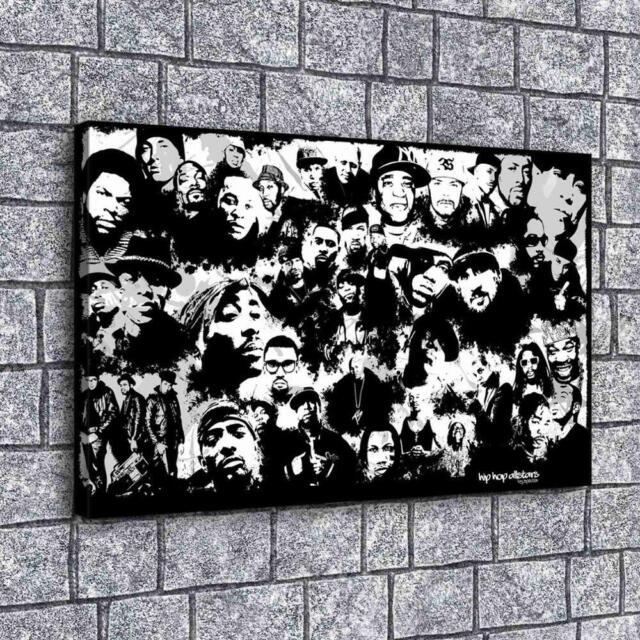
Identify the location of artwork. This screenshot has width=640, height=640. (587, 266).